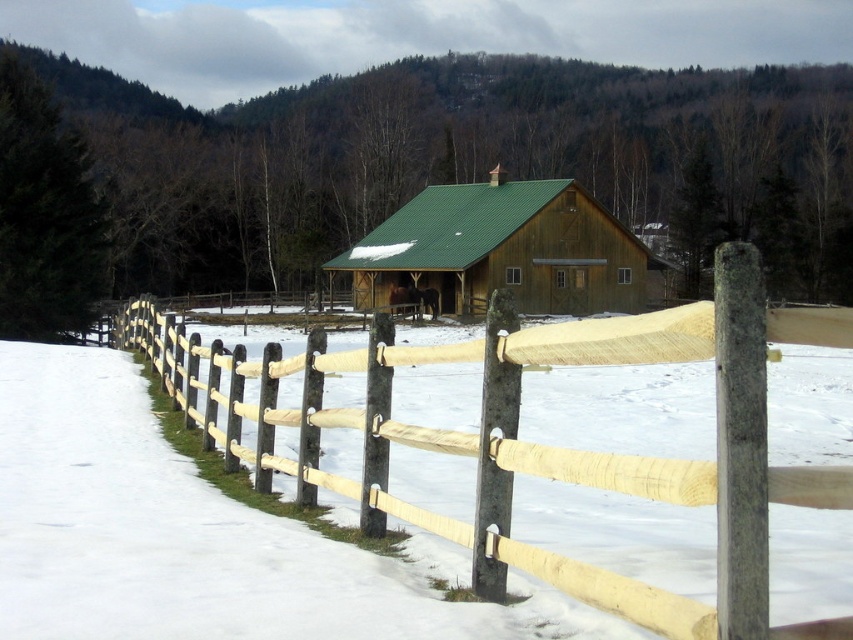
Does wooden split rail fence at center have a lesser height compared to gray wood post at center?

Correct, wooden split rail fence at center is not as tall as gray wood post at center.

Locate an element on the screen. Image resolution: width=853 pixels, height=640 pixels. wooden split rail fence at center is located at coordinates (546, 445).

Is green wooden barn at center closer to the viewer compared to gray wood post at center?

That is False.

Locate an element on the screen. This screenshot has height=640, width=853. green wooden barn at center is located at coordinates (503, 250).

Is point (590, 307) closer to camera compared to point (720, 620)?

No, (590, 307) is further to viewer.

I want to click on green wooden barn at center, so click(503, 250).

Does wooden split rail fence at center have a greater height compared to green wooden barn at center?

Incorrect, wooden split rail fence at center's height is not larger of green wooden barn at center's.

Is wooden split rail fence at center above green wooden barn at center?

Actually, wooden split rail fence at center is below green wooden barn at center.

This screenshot has width=853, height=640. What are the coordinates of `wooden split rail fence at center` in the screenshot? It's located at (546, 445).